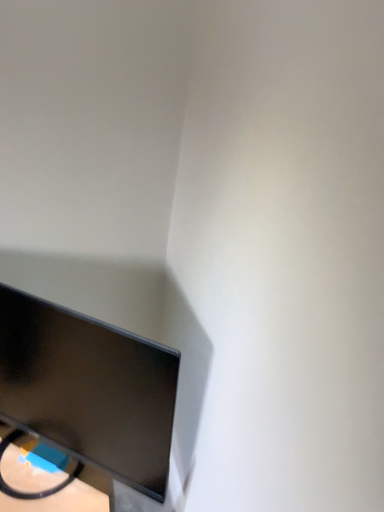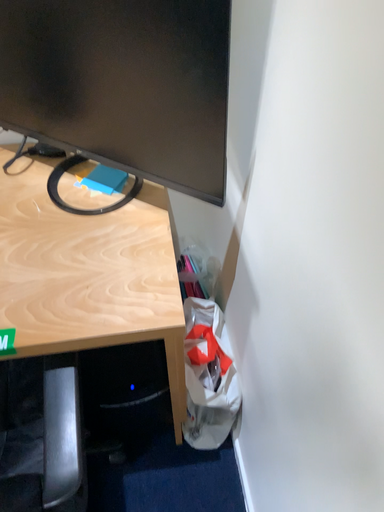
Question: How did the camera likely rotate when shooting the video?

Choices:
 (A) rotated upward
 (B) rotated downward

Answer: (B)